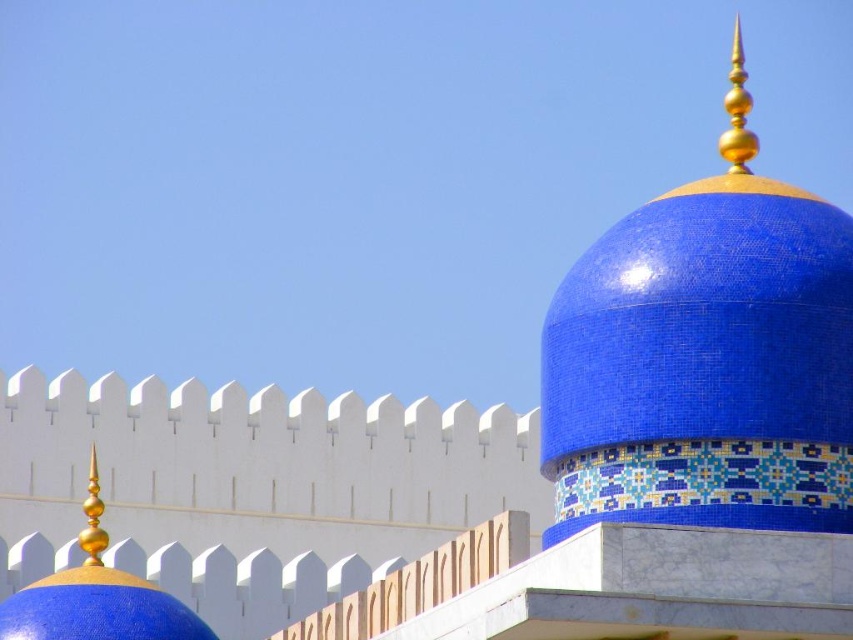
Who is more distant from viewer, (772, 330) or (44, 611)?

The point (44, 611) is more distant.

Identify the location of blue mosaic dome at upper right. (705, 358).